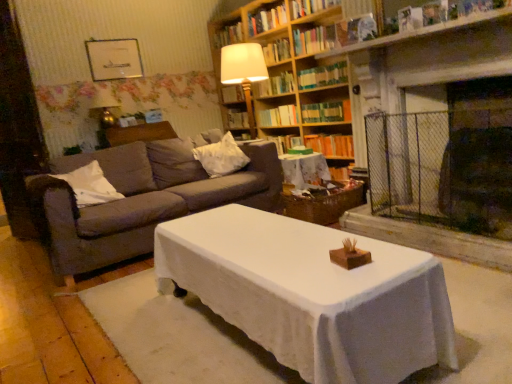
Question: Considering the positions of white soft pillow at left, acting as the first pillow starting from the left, and dark gray fabric couch at left in the image, is white soft pillow at left, acting as the first pillow starting from the left, wider or thinner than dark gray fabric couch at left?

Choices:
 (A) thin
 (B) wide

Answer: (A)

Question: In terms of size, does white soft pillow at left, acting as the first pillow starting from the left, appear bigger or smaller than dark gray fabric couch at left?

Choices:
 (A) small
 (B) big

Answer: (A)

Question: Which is nearer to the matte gold table lamp at upper left?

Choices:
 (A) orange hardcover book at center, arranged as the first book when ordered from the bottom
 (B) white cloth-covered coffee table at center
 (C) white soft pillow at left, positioned as the second pillow in back-to-front order
 (D) hardcover book at center, positioned as the 4th book in bottom-to-top order
 (E) green paperback book at upper center, acting as the 3th book starting from the bottom

Answer: (C)

Question: Which object is the closest to the matte gold table lamp at upper left?

Choices:
 (A) wooden bookshelf at upper center
 (B) hardcover book at center, the 2th book ordered from the bottom
 (C) white cloth-covered coffee table at center
 (D) white cloth-covered table at center
 (E) metallic silver picture frame at upper center

Answer: (E)